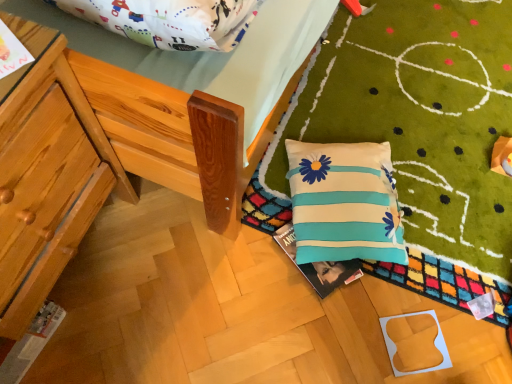
In order to face white fabric pillow with blue stripes and flower patterns at lower right, should I rotate leftwards or rightwards?

To align with it, rotate right about 12.709°.

You are a GUI agent. You are given a task and a screenshot of the screen. Output one action in this format:
    pyautogui.click(x=<x>, y=<y>)
    Task: Click on the white fabric pillow with blue stripes and flower patterns at lower right
    The height and width of the screenshot is (384, 512).
    Given the screenshot: What is the action you would take?
    pyautogui.click(x=344, y=202)

What do you see at coordinates (344, 202) in the screenshot? I see `white fabric pillow with blue stripes and flower patterns at lower right` at bounding box center [344, 202].

What do you see at coordinates (46, 174) in the screenshot? The width and height of the screenshot is (512, 384). I see `wooden chair at left` at bounding box center [46, 174].

You are a GUI agent. You are given a task and a screenshot of the screen. Output one action in this format:
    pyautogui.click(x=<x>, y=<y>)
    Task: Click on the wooden chair at left
    
    Given the screenshot: What is the action you would take?
    pyautogui.click(x=46, y=174)

Identify the location of white fabric pillow with blue stripes and flower patterns at lower right. (344, 202).

Is wooden chair at left at the left side of white fabric pillow with blue stripes and flower patterns at lower right?

Yes, wooden chair at left is to the left of white fabric pillow with blue stripes and flower patterns at lower right.

Considering the positions of objects wooden chair at left and white fabric pillow with blue stripes and flower patterns at lower right in the image provided, who is behind, wooden chair at left or white fabric pillow with blue stripes and flower patterns at lower right?

Positioned behind is white fabric pillow with blue stripes and flower patterns at lower right.

Does point (64, 142) lie behind point (388, 224)?

No, (64, 142) is closer to viewer.

From the image's perspective, is wooden chair at left above white fabric pillow with blue stripes and flower patterns at lower right?

Incorrect, from the image's perspective, wooden chair at left is lower than white fabric pillow with blue stripes and flower patterns at lower right.

From a real-world perspective, is wooden chair at left beneath white fabric pillow with blue stripes and flower patterns at lower right?

Actually, wooden chair at left is physically above white fabric pillow with blue stripes and flower patterns at lower right in the real world.

Considering the relative sizes of wooden chair at left and white fabric pillow with blue stripes and flower patterns at lower right in the image provided, is wooden chair at left wider than white fabric pillow with blue stripes and flower patterns at lower right?

Yes, wooden chair at left is wider than white fabric pillow with blue stripes and flower patterns at lower right.

Between wooden chair at left and white fabric pillow with blue stripes and flower patterns at lower right, which one has more height?

wooden chair at left.

Can you confirm if wooden chair at left is smaller than white fabric pillow with blue stripes and flower patterns at lower right?

Incorrect, wooden chair at left is not smaller in size than white fabric pillow with blue stripes and flower patterns at lower right.

Can we say wooden chair at left lies outside white fabric pillow with blue stripes and flower patterns at lower right?

wooden chair at left lies outside white fabric pillow with blue stripes and flower patterns at lower right's area.

Can you see wooden chair at left touching white fabric pillow with blue stripes and flower patterns at lower right?

No, wooden chair at left is not making contact with white fabric pillow with blue stripes and flower patterns at lower right.

Is wooden chair at left facing towards white fabric pillow with blue stripes and flower patterns at lower right?

No, wooden chair at left is not oriented towards white fabric pillow with blue stripes and flower patterns at lower right.

How far apart are wooden chair at left and white fabric pillow with blue stripes and flower patterns at lower right?

wooden chair at left is 26.36 inches from white fabric pillow with blue stripes and flower patterns at lower right.

Where is `furniture located in front of the white fabric pillow with blue stripes and flower patterns at lower right`? furniture located in front of the white fabric pillow with blue stripes and flower patterns at lower right is located at coordinates (46, 174).

Is white fabric pillow with blue stripes and flower patterns at lower right to the right of wooden chair at left from the viewer's perspective?

Yes.

Consider the image. Considering the positions of objects white fabric pillow with blue stripes and flower patterns at lower right and wooden chair at left in the image provided, who is behind, white fabric pillow with blue stripes and flower patterns at lower right or wooden chair at left?

white fabric pillow with blue stripes and flower patterns at lower right is further from the camera.

Does point (374, 173) come farther from viewer compared to point (64, 183)?

Yes, it is behind point (64, 183).

From the image's perspective, is white fabric pillow with blue stripes and flower patterns at lower right located above or below wooden chair at left?

white fabric pillow with blue stripes and flower patterns at lower right is situated higher than wooden chair at left in the image.

From a real-world perspective, is white fabric pillow with blue stripes and flower patterns at lower right located higher than wooden chair at left?

No, from a real-world perspective, white fabric pillow with blue stripes and flower patterns at lower right is not above wooden chair at left.

Is white fabric pillow with blue stripes and flower patterns at lower right wider or thinner than wooden chair at left?

In the image, white fabric pillow with blue stripes and flower patterns at lower right appears to be more narrow than wooden chair at left.

Is white fabric pillow with blue stripes and flower patterns at lower right taller than wooden chair at left?

No, white fabric pillow with blue stripes and flower patterns at lower right is not taller than wooden chair at left.

In the scene shown: Between white fabric pillow with blue stripes and flower patterns at lower right and wooden chair at left, which one has smaller size?

Smaller between the two is white fabric pillow with blue stripes and flower patterns at lower right.

Is white fabric pillow with blue stripes and flower patterns at lower right completely or partially outside of wooden chair at left?

That's correct, white fabric pillow with blue stripes and flower patterns at lower right is outside of wooden chair at left.

Are white fabric pillow with blue stripes and flower patterns at lower right and wooden chair at left located far from each other?

They are positioned close to each other.

Is white fabric pillow with blue stripes and flower patterns at lower right oriented away from wooden chair at left?

Correct, white fabric pillow with blue stripes and flower patterns at lower right is looking away from wooden chair at left.

Locate an element on the screen. furniture that is in front of the white fabric pillow with blue stripes and flower patterns at lower right is located at coordinates (46, 174).

Locate an element on the screen. This screenshot has height=384, width=512. pillow that appears below the wooden chair at left (from a real-world perspective) is located at coordinates (344, 202).

The height and width of the screenshot is (384, 512). What are the coordinates of `furniture that is above the white fabric pillow with blue stripes and flower patterns at lower right (from a real-world perspective)` in the screenshot? It's located at (46, 174).